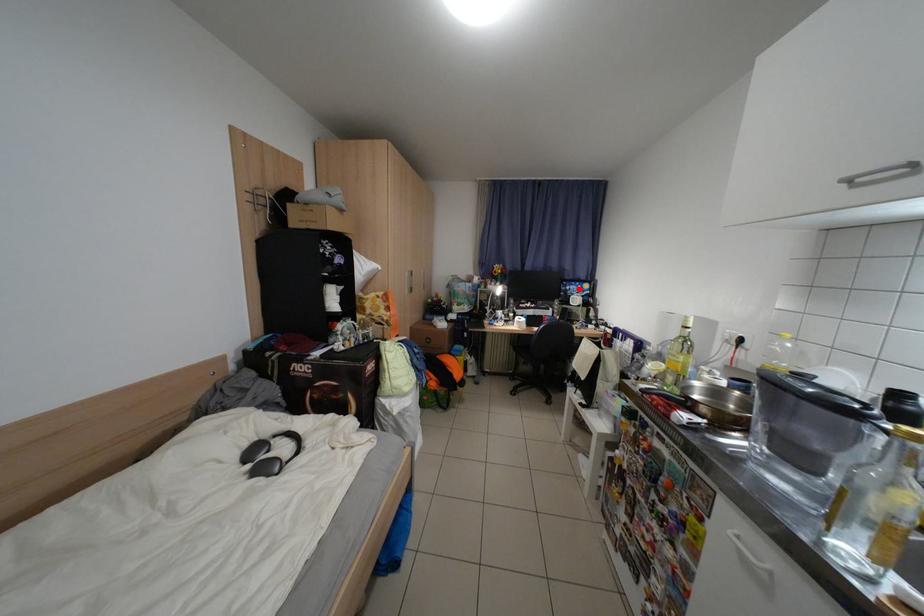
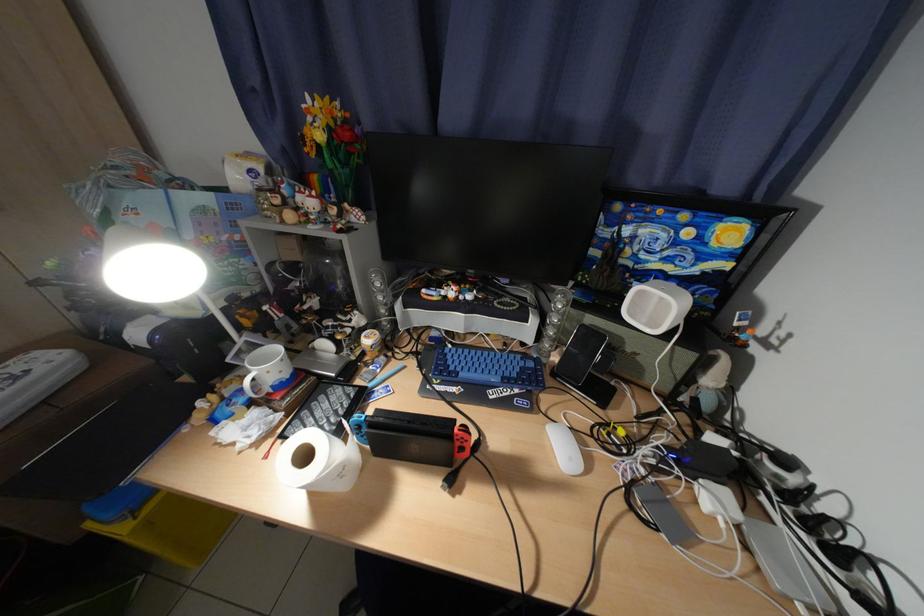
Locate, in the second image, the point that corresponds to the highlighted location in the first image.

(638, 233)